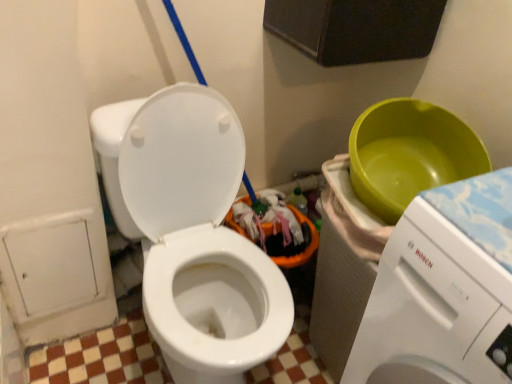
Question: Is there a large distance between white glossy toilet at center and white glossy washing machine at right?

Choices:
 (A) no
 (B) yes

Answer: (A)

Question: Is white glossy toilet at center at the right side of white glossy washing machine at right?

Choices:
 (A) yes
 (B) no

Answer: (B)

Question: Is white glossy toilet at center not within white glossy washing machine at right?

Choices:
 (A) yes
 (B) no

Answer: (A)

Question: Is white glossy toilet at center bigger than white glossy washing machine at right?

Choices:
 (A) no
 (B) yes

Answer: (B)

Question: Is white glossy toilet at center taller than white glossy washing machine at right?

Choices:
 (A) no
 (B) yes

Answer: (A)

Question: Is white glossy toilet at center surrounding white glossy washing machine at right?

Choices:
 (A) no
 (B) yes

Answer: (A)

Question: Is the depth of white glossy washing machine at right greater than that of white glossy toilet at center?

Choices:
 (A) no
 (B) yes

Answer: (A)

Question: Is white glossy washing machine at right positioned with its back to white glossy toilet at center?

Choices:
 (A) yes
 (B) no

Answer: (B)

Question: Considering the relative positions of white glossy washing machine at right and white glossy toilet at center in the image provided, is white glossy washing machine at right to the left of white glossy toilet at center from the viewer's perspective?

Choices:
 (A) no
 (B) yes

Answer: (A)

Question: Does white glossy washing machine at right turn towards white glossy toilet at center?

Choices:
 (A) yes
 (B) no

Answer: (B)

Question: Considering the relative sizes of white glossy washing machine at right and white glossy toilet at center in the image provided, is white glossy washing machine at right wider than white glossy toilet at center?

Choices:
 (A) no
 (B) yes

Answer: (B)

Question: Is white glossy toilet at center a part of white glossy washing machine at right?

Choices:
 (A) yes
 (B) no

Answer: (B)

Question: Is point (467, 364) positioned closer to the camera than point (239, 352)?

Choices:
 (A) closer
 (B) farther

Answer: (A)